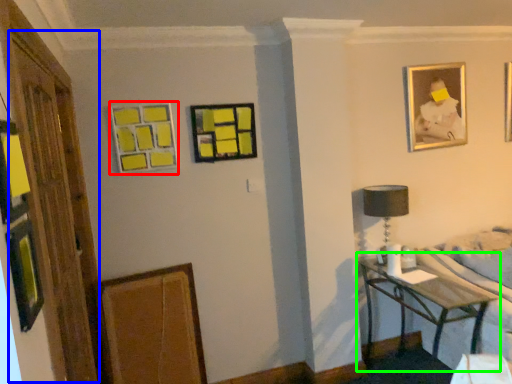
Question: Which object is the closest to the picture frame (highlighted by a red box)? Choose among these: glass door (highlighted by a blue box) or table (highlighted by a green box).

Choices:
 (A) glass door
 (B) table

Answer: (A)